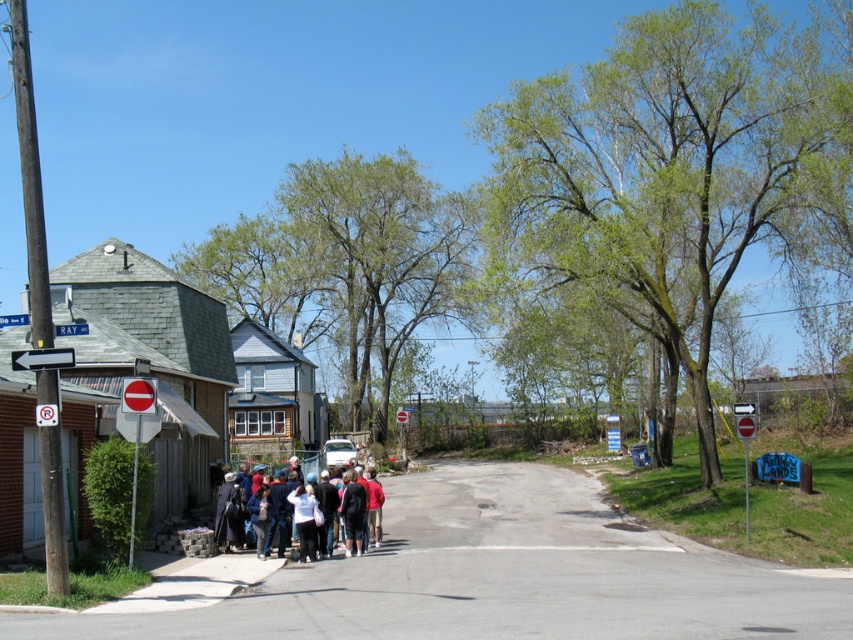
You are a delivery person trying to find the address located at the brick building with the sign that says Ray. You see a dark blue jacket at center and a white plastic arrow at left. According to the scene, which object is closer to the brick building with the sign Ray?

The dark blue jacket at center is positioned under the white plastic arrow at left, so the dark blue jacket at center is closer to the brick building with the sign Ray.

You are driving a car and see the white plastic arrow at left and the red plastic stop sign at center. Which traffic control device is positioned higher relative to the other?

The white plastic arrow at left is located above the red plastic stop sign at center.

Consider the image. You are standing at the entrance of the brick building with a sign that reads Ray. You want to walk directly towards the dark blue jacket at center. Which direction should you go?

The dark blue jacket at center is located at point 0.811 in the x coordinate and 0.376 in the y coordinate. Since you are at the entrance of the building, which is on the left side of the road, you should walk towards the right to reach the dark blue jacket at center.